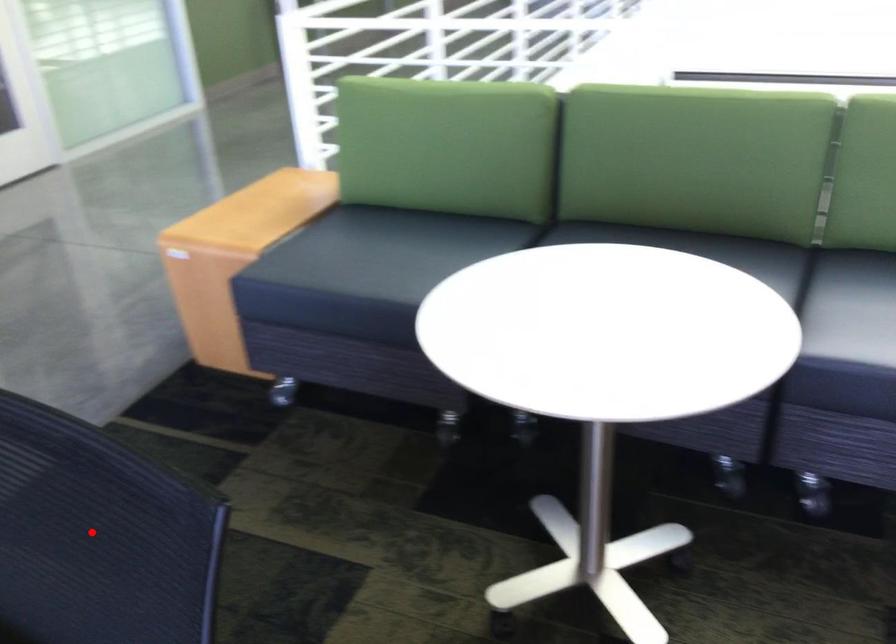
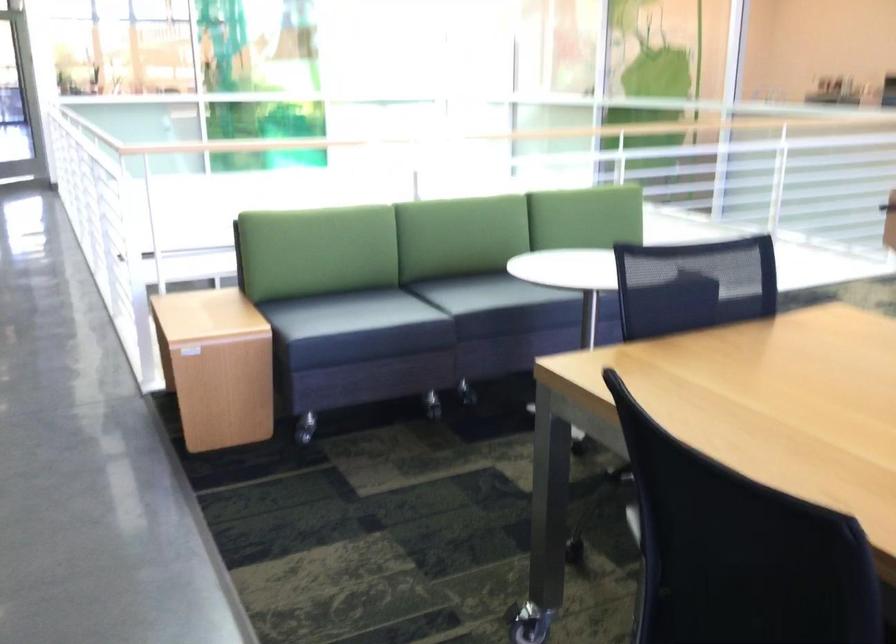
The point at the highlighted location is marked in the first image. Where is the corresponding point in the second image?

(695, 275)